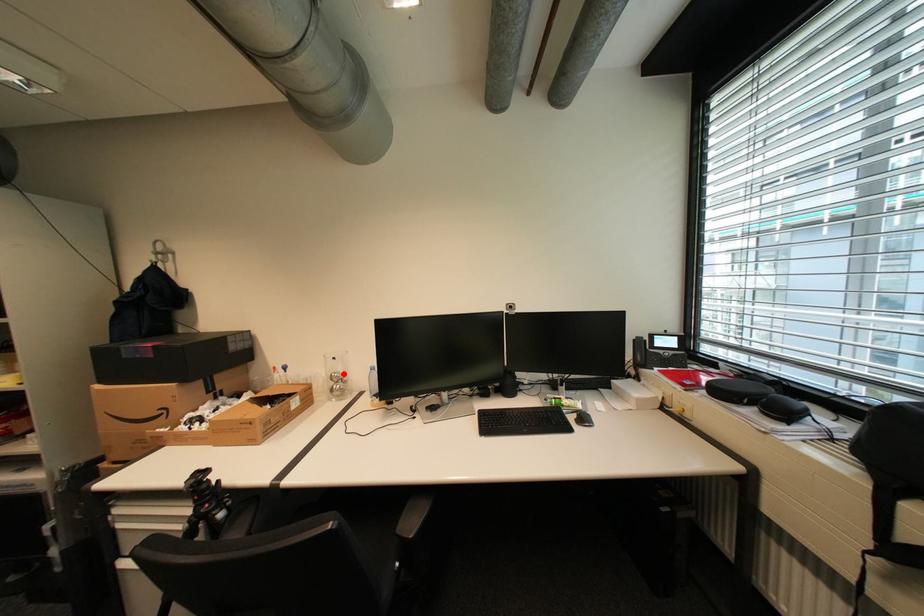
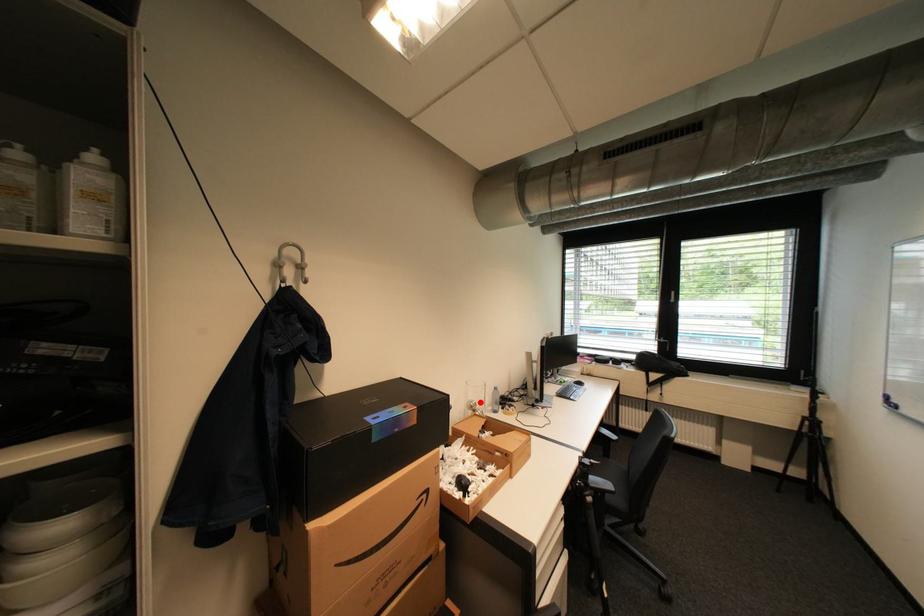
I am providing you with two images of the same scene from different viewpoints. A red point is marked on the first image and another point is marked on the second image. Is the marked point in image1 the same physical position as the marked point in image2?

Yes